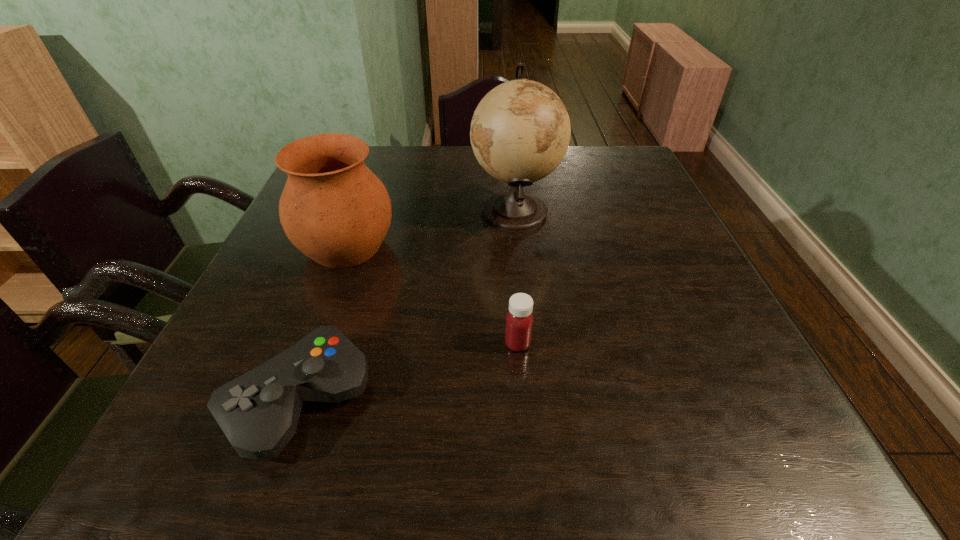
I want to click on vacant space that's between the globe and the third shortest object, so click(x=430, y=228).

At what (x,y) coordinates should I click in order to perform the action: click on vacant point located between the third shortest object and the control. Please return your answer as a coordinate pair (x, y). Image resolution: width=960 pixels, height=540 pixels. Looking at the image, I should click on (323, 323).

In order to click on vacant space that is in between the medicine and the pottery in this screenshot , I will do `click(432, 295)`.

Locate an element on the screen. The image size is (960, 540). empty location between the medicine and the shortest object is located at coordinates (409, 372).

Where is `blank region between the pottery and the second shortest object`? blank region between the pottery and the second shortest object is located at coordinates (432, 295).

Find the location of a particular element. This screenshot has height=540, width=960. empty space between the medicine and the control is located at coordinates (409, 372).

Where is `free space between the second shortest object and the shortest object`? The image size is (960, 540). free space between the second shortest object and the shortest object is located at coordinates (409, 372).

Find the location of a particular element. This screenshot has height=540, width=960. empty space that is in between the pottery and the medicine is located at coordinates (432, 295).

Locate an element on the screen. vacant point located between the globe and the second shortest object is located at coordinates (516, 277).

In order to click on vacant area between the globe and the second tallest object in this screenshot , I will do `click(430, 228)`.